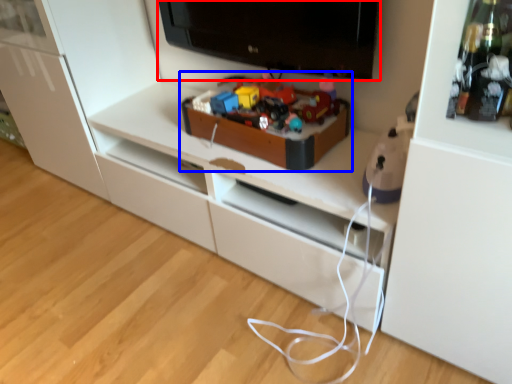
Question: Which of the following is the closest to the observer, television (highlighted by a red box) or toy (highlighted by a blue box)?

Choices:
 (A) television
 (B) toy

Answer: (A)